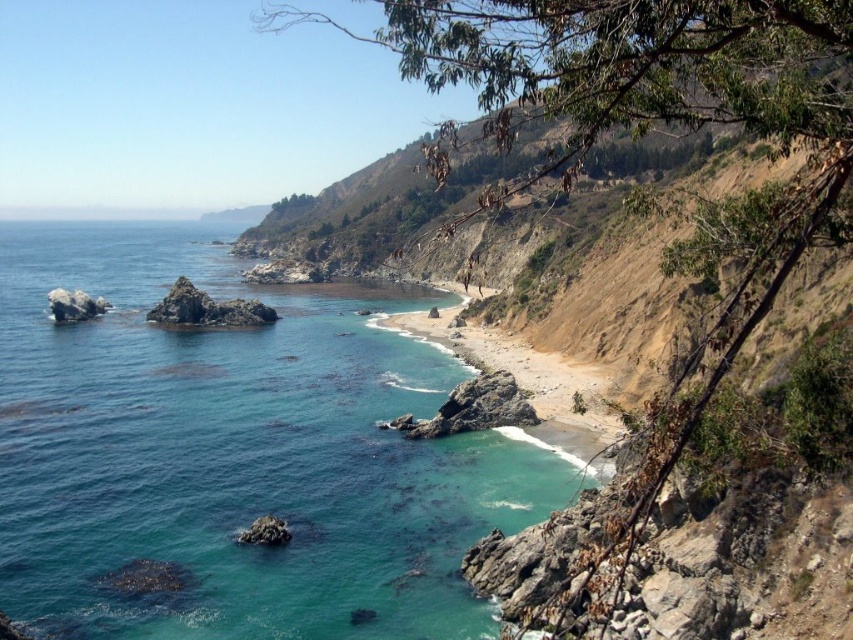
Question: Among these objects, which one is farthest from the camera?

Choices:
 (A) rusty rock at lower center
 (B) clear blue water at lower left
 (C) sandy beach at lower center
 (D) rusty rock at center-left

Answer: (D)

Question: Considering the real-world distances, which object is closest to the rusty rock at lower center?

Choices:
 (A) clear blue water at lower left
 (B) gray rock at left
 (C) rusty rock at center-left

Answer: (A)

Question: Is rusty rock at lower center smaller than rusty rock at center-left?

Choices:
 (A) no
 (B) yes

Answer: (B)

Question: Observing the image, what is the correct spatial positioning of clear blue water at lower left in reference to sandy beach at lower center?

Choices:
 (A) above
 (B) below

Answer: (A)

Question: Which of the following is the closest to the observer?

Choices:
 (A) sandy beach at lower center
 (B) gray rock at left
 (C) rusty rock at lower center

Answer: (A)

Question: Does rusty rock at center-left have a lesser width compared to gray rock at left?

Choices:
 (A) yes
 (B) no

Answer: (B)